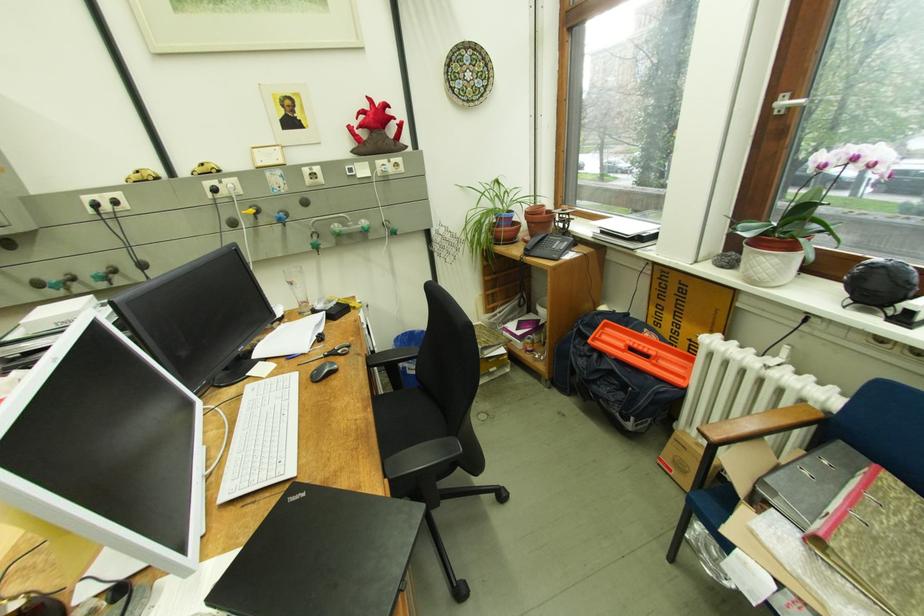
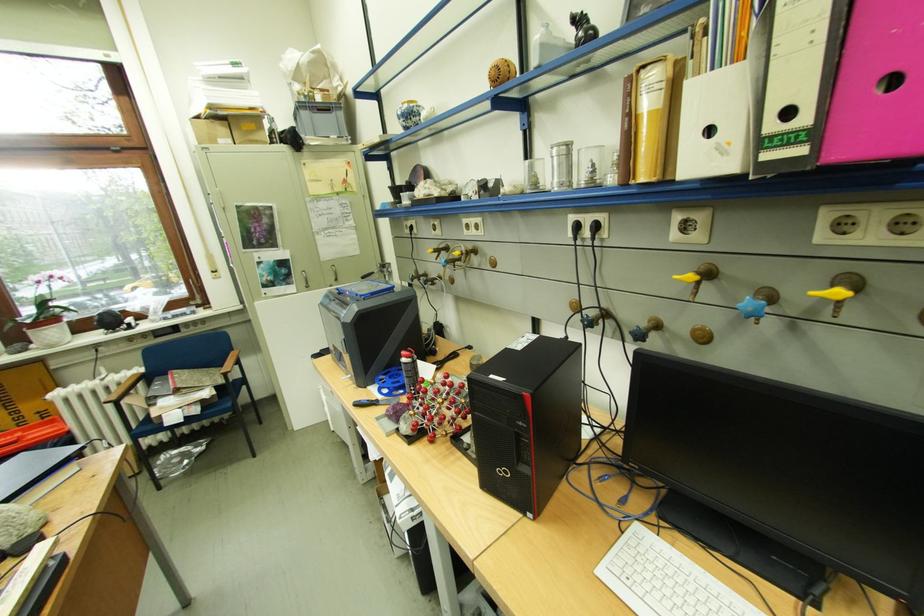
Where in the second image is the point corresponding to the point at 758,249 from the first image?

(41, 334)